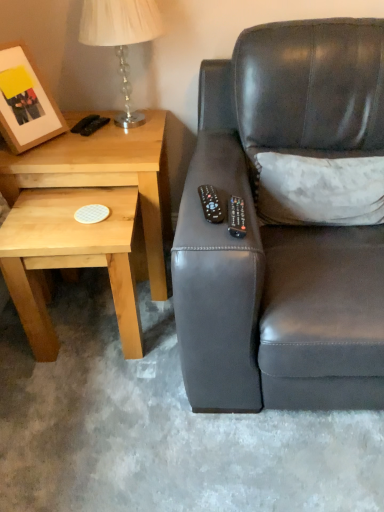
You are a GUI agent. You are given a task and a screenshot of the screen. Output one action in this format:
    pyautogui.click(x=<x>, y=<y>)
    Task: Click on the free point below translucent glass table lamp at upper left (from a real-world perspective)
    This screenshot has width=384, height=512.
    Given the screenshot: What is the action you would take?
    pyautogui.click(x=123, y=129)